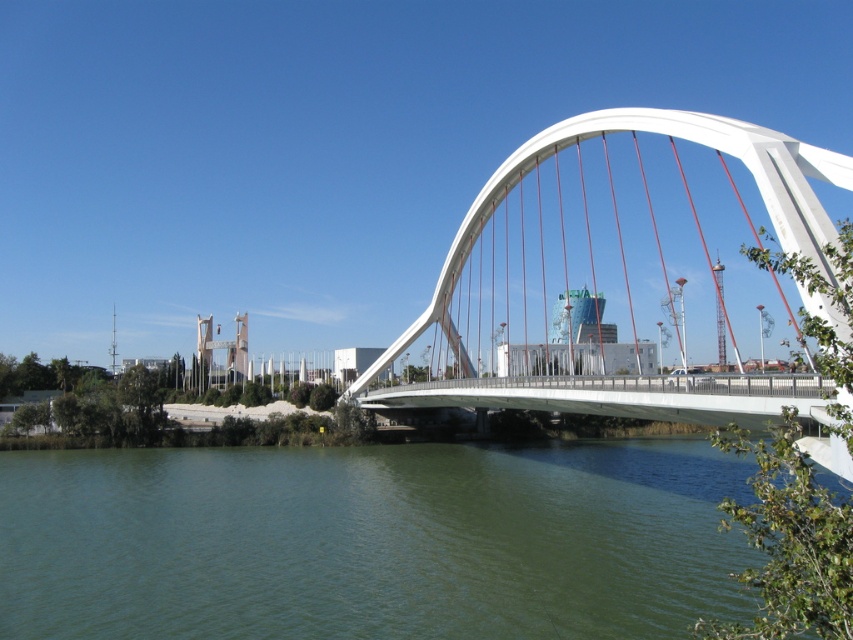
Does green water at lower center have a lesser height compared to white metallic arch bridge at center?

Yes, green water at lower center is shorter than white metallic arch bridge at center.

From the picture: Can you confirm if green water at lower center is positioned to the left of white metallic arch bridge at center?

Yes, green water at lower center is to the left of white metallic arch bridge at center.

The height and width of the screenshot is (640, 853). What do you see at coordinates (370, 540) in the screenshot?
I see `green water at lower center` at bounding box center [370, 540].

Identify the location of green water at lower center. This screenshot has height=640, width=853. (370, 540).